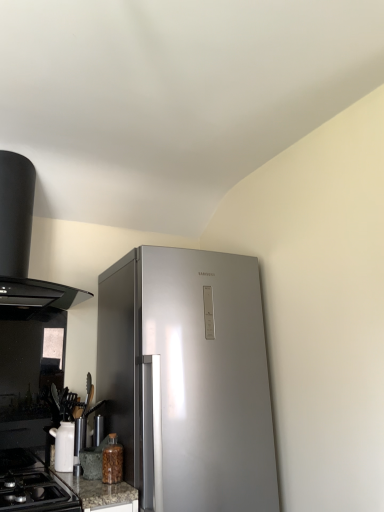
Question: Are black matte range hood at upper left and white glossy teapot at lower left located far from each other?

Choices:
 (A) yes
 (B) no

Answer: (B)

Question: Considering the relative sizes of black matte range hood at upper left and white glossy teapot at lower left in the image provided, is black matte range hood at upper left thinner than white glossy teapot at lower left?

Choices:
 (A) yes
 (B) no

Answer: (B)

Question: Is black matte range hood at upper left bigger than white glossy teapot at lower left?

Choices:
 (A) no
 (B) yes

Answer: (B)

Question: Can you see black matte range hood at upper left touching white glossy teapot at lower left?

Choices:
 (A) yes
 (B) no

Answer: (B)

Question: From a real-world perspective, is black matte range hood at upper left positioned under white glossy teapot at lower left based on gravity?

Choices:
 (A) no
 (B) yes

Answer: (A)

Question: Is black matte range hood at upper left at the left side of white glossy teapot at lower left?

Choices:
 (A) no
 (B) yes

Answer: (B)

Question: From the image's perspective, is black glass gas stove at lower left on translucent glass jar at lower left?

Choices:
 (A) yes
 (B) no

Answer: (B)

Question: From a real-world perspective, is black glass gas stove at lower left physically above translucent glass jar at lower left?

Choices:
 (A) no
 (B) yes

Answer: (A)

Question: Is black glass gas stove at lower left not within translucent glass jar at lower left?

Choices:
 (A) no
 (B) yes

Answer: (B)

Question: Would you say translucent glass jar at lower left is part of black glass gas stove at lower left's contents?

Choices:
 (A) no
 (B) yes

Answer: (A)

Question: Would you say black glass gas stove at lower left is a long distance from translucent glass jar at lower left?

Choices:
 (A) yes
 (B) no

Answer: (B)

Question: Does black glass gas stove at lower left have a smaller size compared to translucent glass jar at lower left?

Choices:
 (A) yes
 (B) no

Answer: (B)

Question: Can you confirm if white glossy teapot at lower left is taller than black glass gas stove at lower left?

Choices:
 (A) no
 (B) yes

Answer: (B)